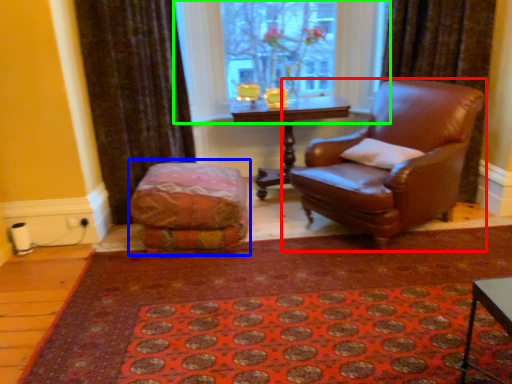
Question: Which object is positioned farthest from chair (highlighted by a red box)? Select from bean bag chair (highlighted by a blue box) and window (highlighted by a green box).

Choices:
 (A) bean bag chair
 (B) window

Answer: (B)